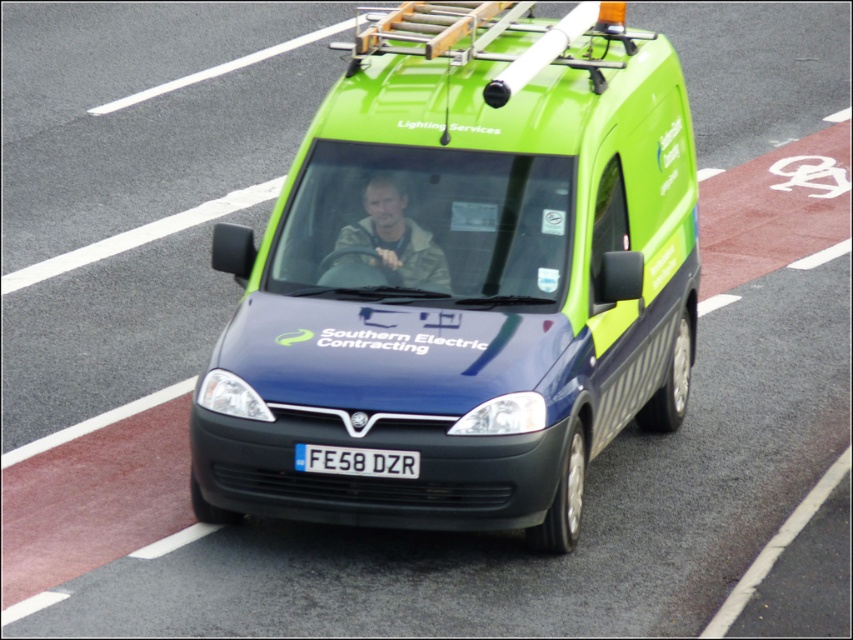
Question: Which point is closer to the camera?

Choices:
 (A) (450, 291)
 (B) (363, 474)

Answer: (B)

Question: Estimate the real-world distances between objects in this image. Which object is closer to the black plastic license plate at center?

Choices:
 (A) green matte van at center
 (B) camouflage fabric at center

Answer: (B)

Question: Which point is closer to the camera?

Choices:
 (A) camouflage fabric at center
 (B) green matte van at center
 (C) black plastic license plate at center

Answer: (B)

Question: Does green matte van at center appear over camouflage fabric at center?

Choices:
 (A) yes
 (B) no

Answer: (B)

Question: Is camouflage fabric at center closer to the viewer compared to black plastic license plate at center?

Choices:
 (A) yes
 (B) no

Answer: (B)

Question: Does green matte van at center appear on the left side of black plastic license plate at center?

Choices:
 (A) yes
 (B) no

Answer: (B)